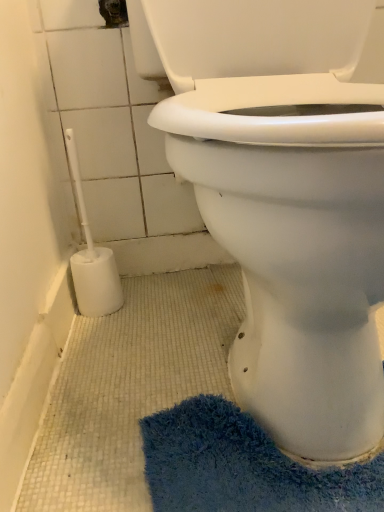
At what (x,y) coordinates should I click in order to perform the action: click on free space above blue shaggy bath mat at lower right (from a real-world perspective). Please return your answer as a coordinate pair (x, y). The width and height of the screenshot is (384, 512). Looking at the image, I should click on (256, 453).